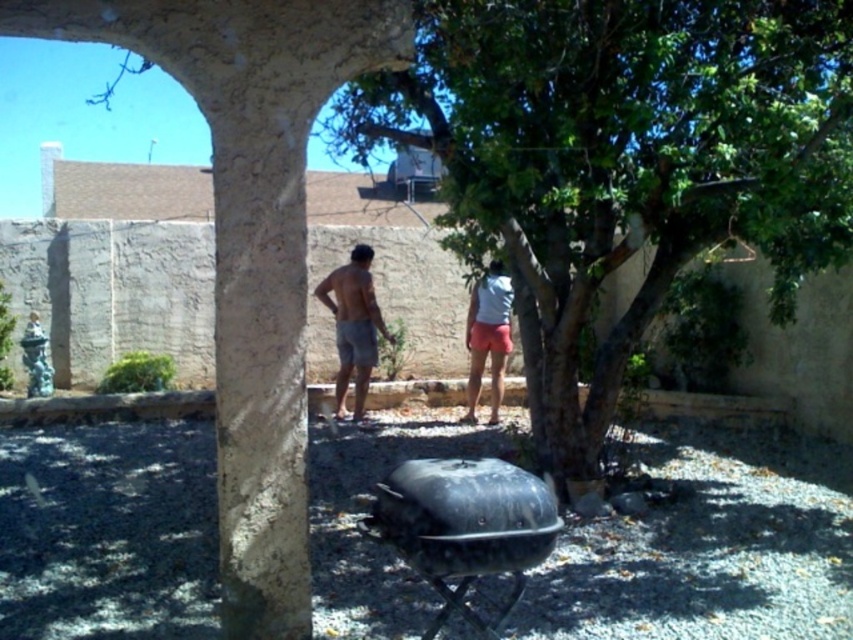
You are planning to set up a picnic blanket in the shaded area near the green leafy tree at center and the gray cotton shorts at center. Based on their positions, which object should you place the blanket closer to to ensure it stays in the shade?

The green leafy tree at center is to the right of gray cotton shorts at center. Since the tree provides shade, placing the blanket closer to the green leafy tree at center would ensure it stays in the shade.

You are planning to install a small bench between the green leafy tree at center and the light blue fabric shirt at center. If the bench requires a minimum of 2 meters of space, will there be enough room?

The distance between the green leafy tree at center and the light blue fabric shirt at center is 2.45 meters, which is more than the required 2 meters. Therefore, there is sufficient space to install the bench.